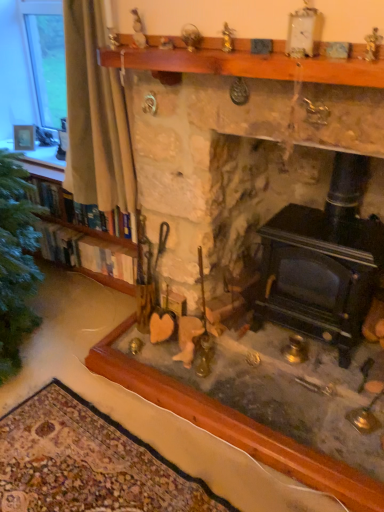
Locate an element on the screen. This screenshot has width=384, height=512. vacant area situated below wooden bookshelf at left (from a real-world perspective) is located at coordinates (73, 282).